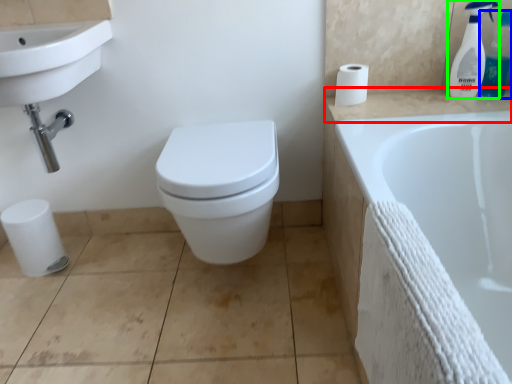
Question: Estimate the real-world distances between objects in this image. Which object is farther from counter top (highlighted by a red box), cleaning product (highlighted by a blue box) or cleaning product (highlighted by a green box)?

Choices:
 (A) cleaning product
 (B) cleaning product

Answer: (A)